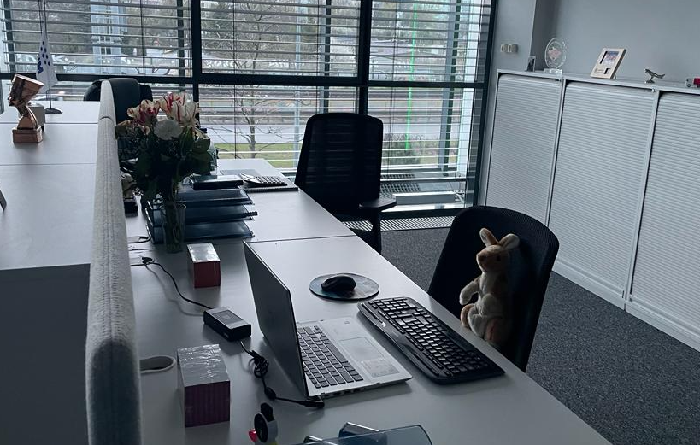
Locate an element on the screen. 1 bronze statue is located at coordinates (17, 138).